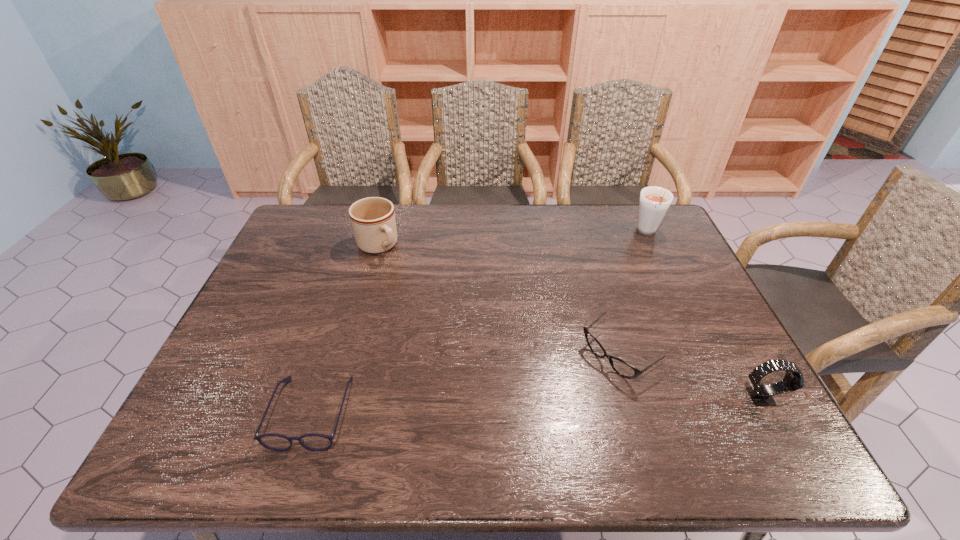
I want to click on free space between the watch and the left spectacles, so click(537, 404).

Identify the location of empty location between the mug and the watch. Image resolution: width=960 pixels, height=540 pixels. (569, 321).

I want to click on free space between the root beer and the right spectacles, so click(634, 294).

In order to click on blank region between the mug and the left spectacles in this screenshot , I will do `click(345, 329)`.

Locate an element on the screen. The width and height of the screenshot is (960, 540). vacant area between the watch and the mug is located at coordinates (569, 321).

At what (x,y) coordinates should I click in order to perform the action: click on blank region between the root beer and the third object from left to right. Please return your answer as a coordinate pair (x, y). This screenshot has height=540, width=960. Looking at the image, I should click on (634, 294).

At what (x,y) coordinates should I click in order to perform the action: click on free space between the third object from left to right and the tallest object. Please return your answer as a coordinate pair (x, y). The image size is (960, 540). Looking at the image, I should click on (634, 294).

Select which object appears as the second closest to the mug. Please provide its 2D coordinates. Your answer should be formatted as a tuple, i.e. [(x, y)], where the tuple contains the x and y coordinates of a point satisfying the conditions above.

[(624, 369)]

Where is `object that stands as the closest to the left spectacles`? This screenshot has width=960, height=540. object that stands as the closest to the left spectacles is located at coordinates (373, 222).

You are a GUI agent. You are given a task and a screenshot of the screen. Output one action in this format:
    pyautogui.click(x=<x>, y=<y>)
    Task: Click on the vacant space that satisfies the following two spatial constraints: 1. on the back side of the tallest object; 2. on the right side of the mug
    
    Given the screenshot: What is the action you would take?
    pyautogui.click(x=381, y=233)